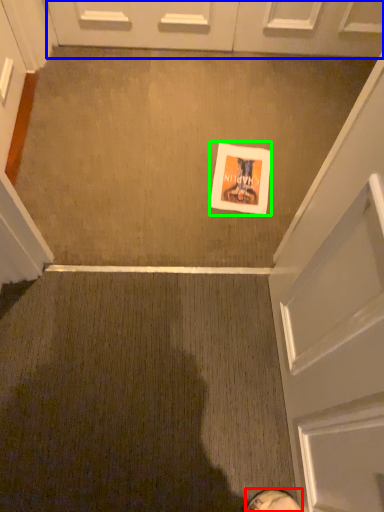
Question: Estimate the real-world distances between objects in this image. Which object is closer to footwear (highlighted by a red box), door (highlighted by a blue box) or flyer (highlighted by a green box)?

Choices:
 (A) door
 (B) flyer

Answer: (B)